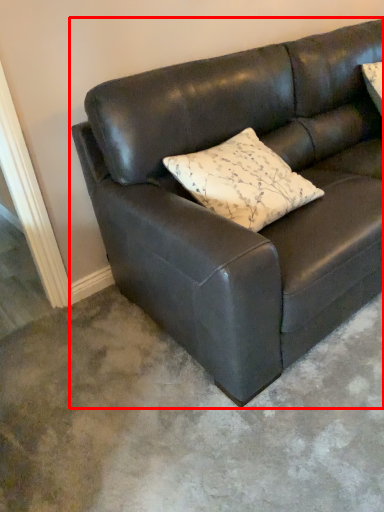
Question: From the image's perspective, what is the correct spatial positioning of studio couch (annotated by the red box) in reference to pillow?

Choices:
 (A) below
 (B) above

Answer: (B)